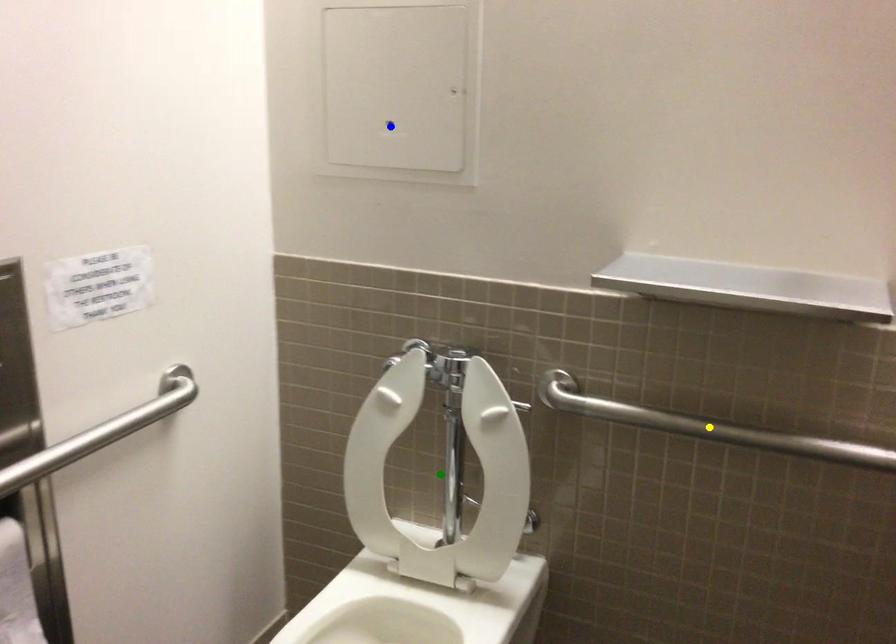
Order these from nearest to farthest:
yellow point
blue point
green point

yellow point
green point
blue point